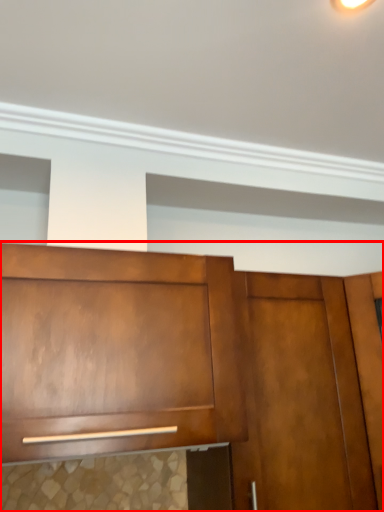
Question: In this image, where is cabinetry (annotated by the red box) located relative to door?

Choices:
 (A) right
 (B) left

Answer: (B)